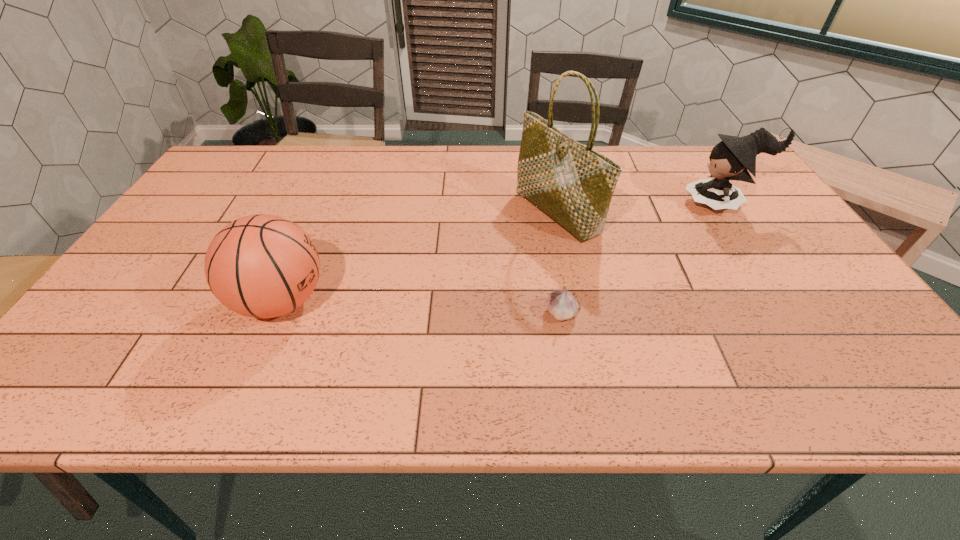
Where is `free space that satisfies the following two spatial constraints: 1. on the back side of the garlic; 2. on the surface of the leftmost object near the brand logo`? This screenshot has width=960, height=540. free space that satisfies the following two spatial constraints: 1. on the back side of the garlic; 2. on the surface of the leftmost object near the brand logo is located at coordinates (559, 301).

The height and width of the screenshot is (540, 960). I want to click on vacant space that satisfies the following two spatial constraints: 1. on the front side of the shopping bag; 2. on the surface of the basketball near the brand logo, so click(575, 301).